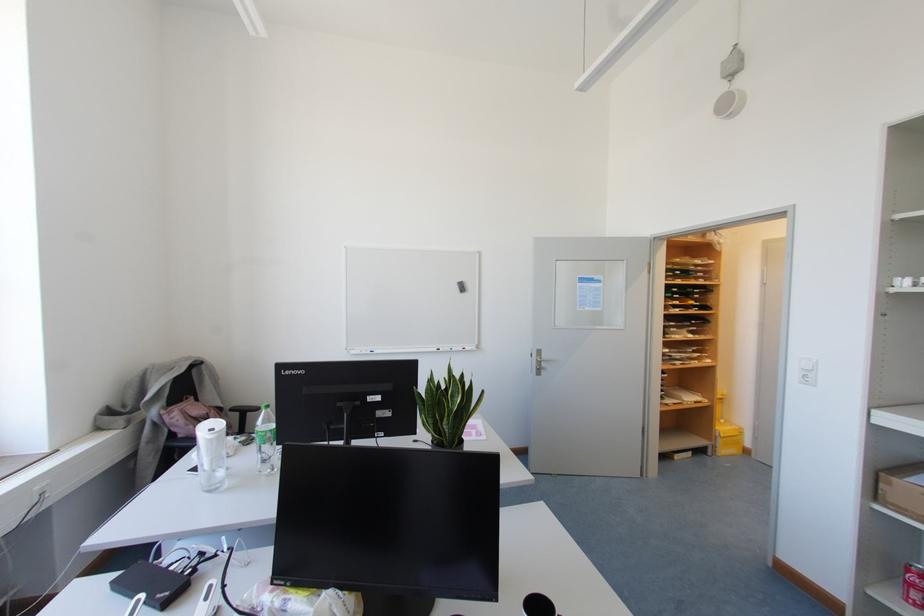
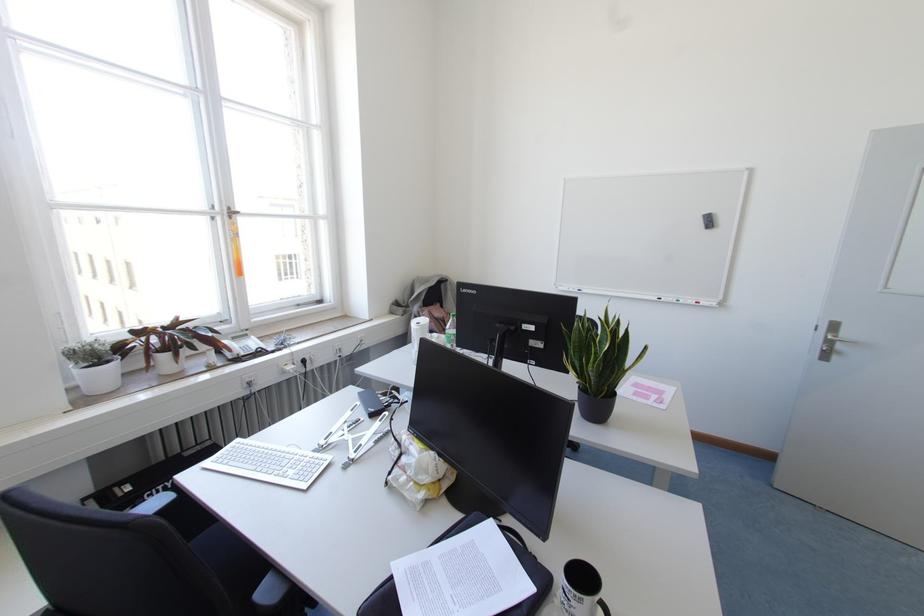
Find the pixel in the second image that matches point (450, 349) in the first image.

(676, 300)